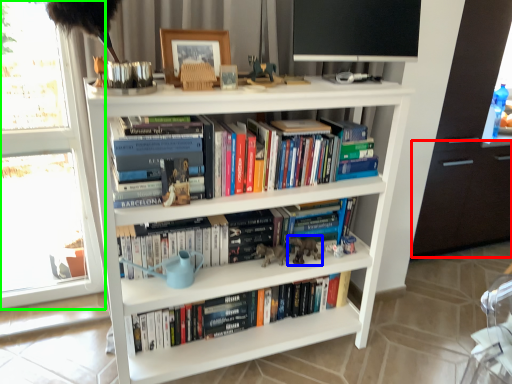
Question: Based on their relative distances, which object is nearer to drawer (highlighted by a red box)? Choose from animal (highlighted by a blue box) and window frame (highlighted by a green box).

Choices:
 (A) animal
 (B) window frame

Answer: (A)